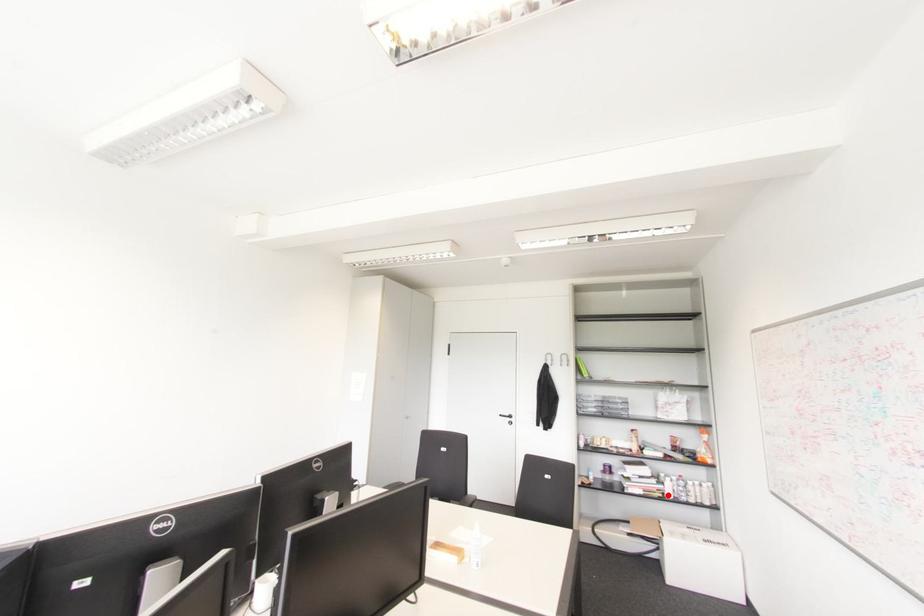
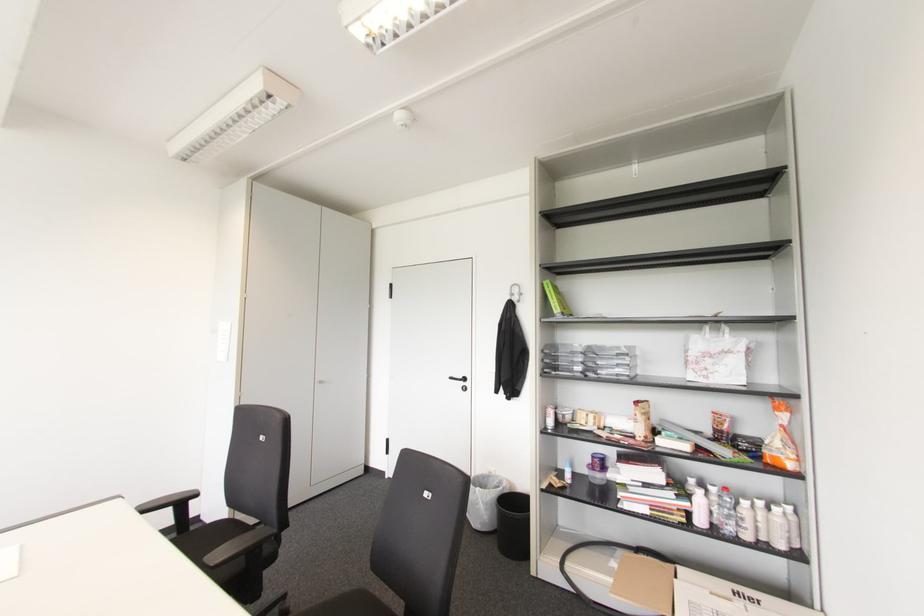
Locate, in the second image, the point that corresponds to the highlighted location in the first image.

(699, 521)